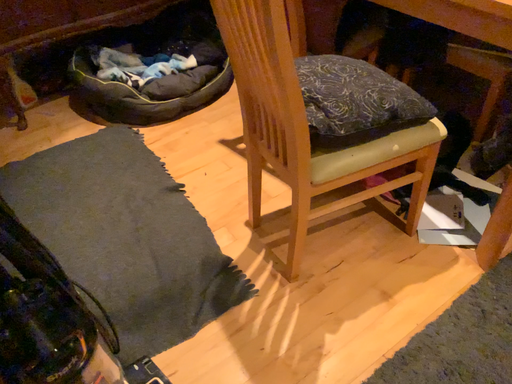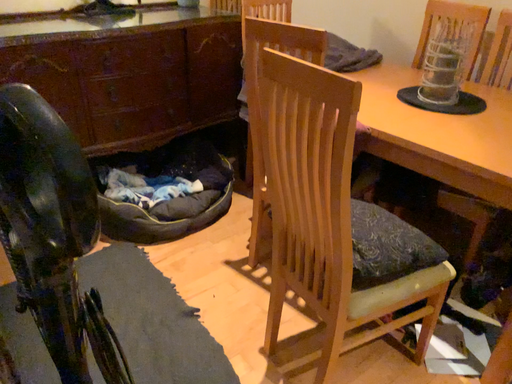
Question: How did the camera likely rotate when shooting the video?

Choices:
 (A) rotated downward
 (B) rotated upward

Answer: (B)